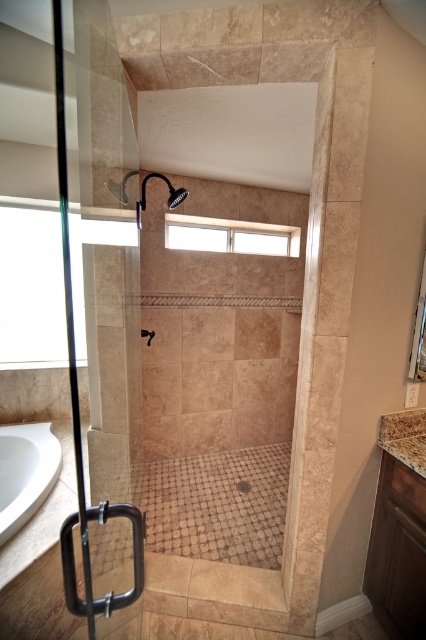
You are trying to locate the window in the bathroom. You see the transparent glass door at left and the clear glass window at upper center. Which object is higher up in the bathroom?

The clear glass window at upper center is higher up than the transparent glass door at left.

You are standing in the bathroom and want to take a bath. Where is the white glossy bathtub at lower left located?

The white glossy bathtub at lower left is located at point (x=25, y=472).

You are standing in the bathroom and want to place a small plant between the two points marked as point (58,381) and point (230,248). Which point should the plant be closer to in order to be positioned between them?

The plant should be closer to point (230,248) because point (58,381) is in front of point (230,248), meaning the latter is behind the former. Placing the plant closer to the rear point would position it between the two points along the depth axis.